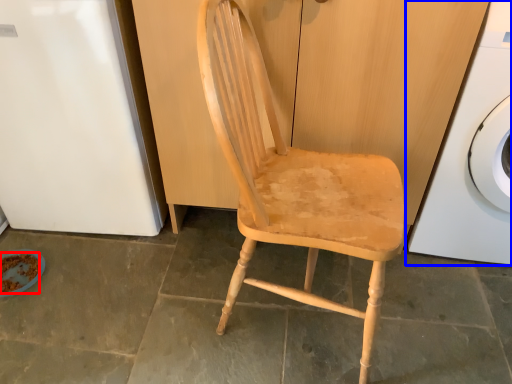
Question: Which point is further to the camera, food (highlighted by a red box) or washing machine (highlighted by a blue box)?

Choices:
 (A) food
 (B) washing machine

Answer: (A)